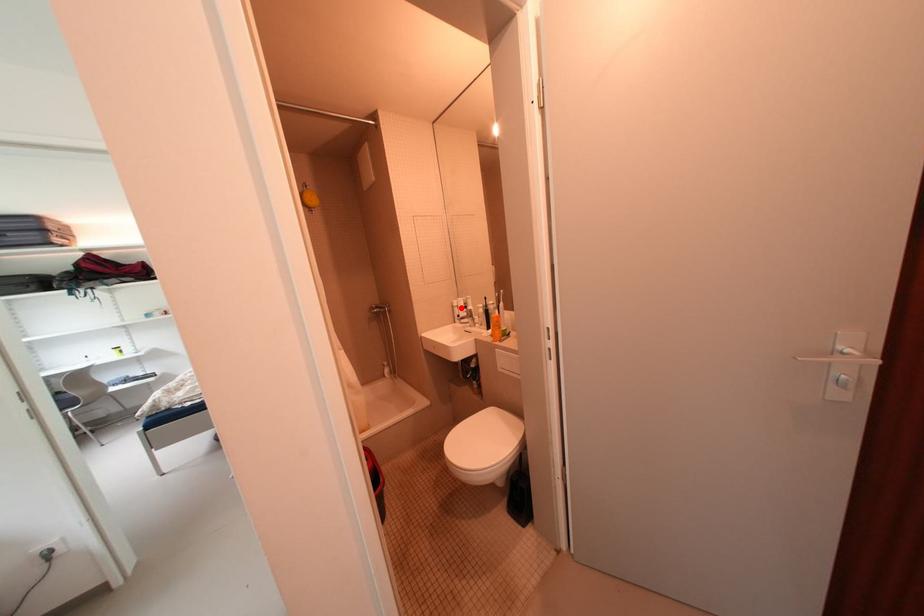
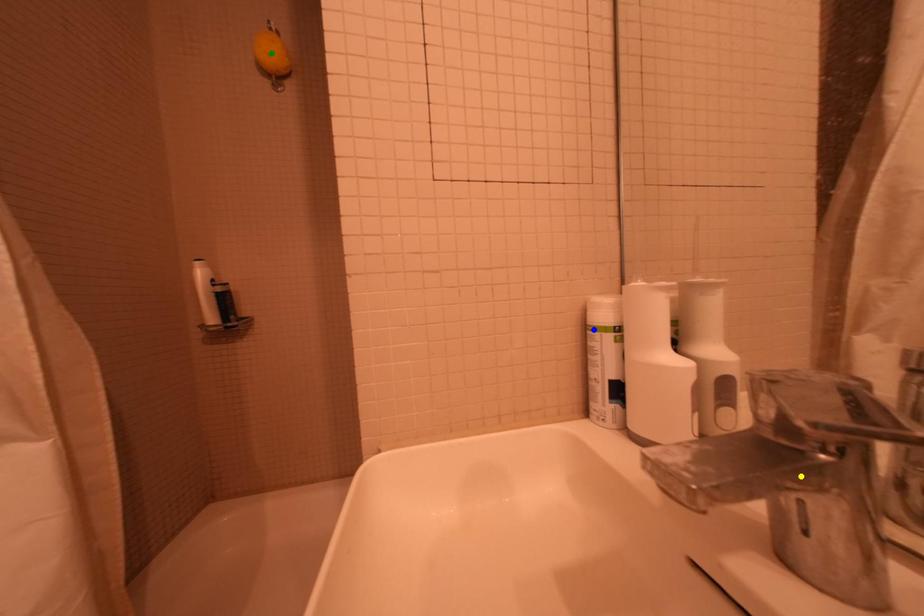
Question: I am providing you with two images of the same scene from different viewpoints. A red point is marked on the first image. You are given multiple points on the second image. Which point in image 2 is actually the same real-world point as the red point in image 1?

Choices:
 (A) green point
 (B) blue point
 (C) yellow point

Answer: (B)